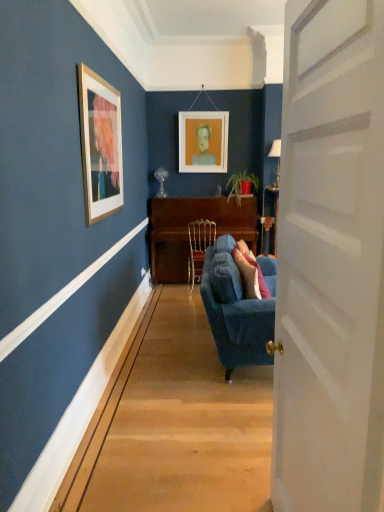
Question: From a real-world perspective, is metallic silver lamp at right, the second lamp when ordered from back to front, positioned under green matte plant at center based on gravity?

Choices:
 (A) no
 (B) yes

Answer: (A)

Question: Are metallic silver lamp at right, arranged as the 1th lamp when viewed from the front, and green matte plant at center far apart?

Choices:
 (A) yes
 (B) no

Answer: (B)

Question: Does metallic silver lamp at right, the second lamp when ordered from back to front, appear on the left side of green matte plant at center?

Choices:
 (A) no
 (B) yes

Answer: (A)

Question: Is metallic silver lamp at right, the second lamp when ordered from back to front, taller than green matte plant at center?

Choices:
 (A) yes
 (B) no

Answer: (A)

Question: Considering the relative sizes of metallic silver lamp at right, the first lamp in the right-to-left sequence, and green matte plant at center in the image provided, is metallic silver lamp at right, the first lamp in the right-to-left sequence, bigger than green matte plant at center?

Choices:
 (A) no
 (B) yes

Answer: (A)

Question: Considering the positions of point (380, 90) and point (190, 280), is point (380, 90) closer or farther from the camera than point (190, 280)?

Choices:
 (A) farther
 (B) closer

Answer: (B)

Question: Based on their positions, is white wooden door at right located to the left or right of gold metallic chair at center?

Choices:
 (A) right
 (B) left

Answer: (A)

Question: Is white wooden door at right inside or outside of gold metallic chair at center?

Choices:
 (A) inside
 (B) outside

Answer: (B)

Question: In terms of size, does white wooden door at right appear bigger or smaller than gold metallic chair at center?

Choices:
 (A) small
 (B) big

Answer: (B)

Question: Looking at their shapes, would you say green matte plant at center is wider or thinner than wooden polished desk at center?

Choices:
 (A) thin
 (B) wide

Answer: (A)

Question: From a real-world perspective, is green matte plant at center positioned above or below wooden polished desk at center?

Choices:
 (A) above
 (B) below

Answer: (A)

Question: Considering the positions of green matte plant at center and wooden polished desk at center in the image, is green matte plant at center taller or shorter than wooden polished desk at center?

Choices:
 (A) short
 (B) tall

Answer: (A)

Question: In the image, is green matte plant at center positioned in front of or behind wooden polished desk at center?

Choices:
 (A) front
 (B) behind

Answer: (B)

Question: Is wooden polished desk at center taller or shorter than velvet blue couch at center?

Choices:
 (A) tall
 (B) short

Answer: (A)

Question: From a real-world perspective, is wooden polished desk at center above or below velvet blue couch at center?

Choices:
 (A) above
 (B) below

Answer: (A)